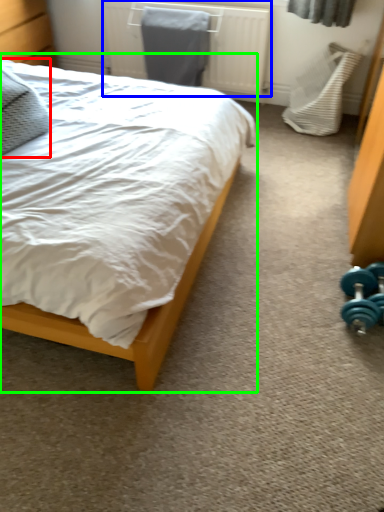
Question: Based on their relative distances, which object is farther from pillow (highlighted by a red box)? Choose from radiator (highlighted by a blue box) and bed (highlighted by a green box).

Choices:
 (A) radiator
 (B) bed

Answer: (A)